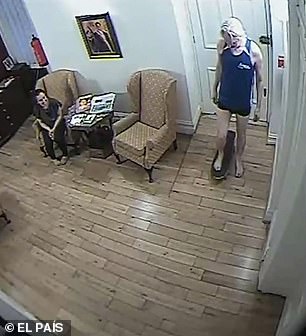
You are a GUI agent. You are given a task and a screenshot of the screen. Output one action in this format:
    pyautogui.click(x=<x>, y=<y>)
    Task: Click on the picture on wall
    The width and height of the screenshot is (306, 336).
    Given the screenshot: What is the action you would take?
    pyautogui.click(x=91, y=30)